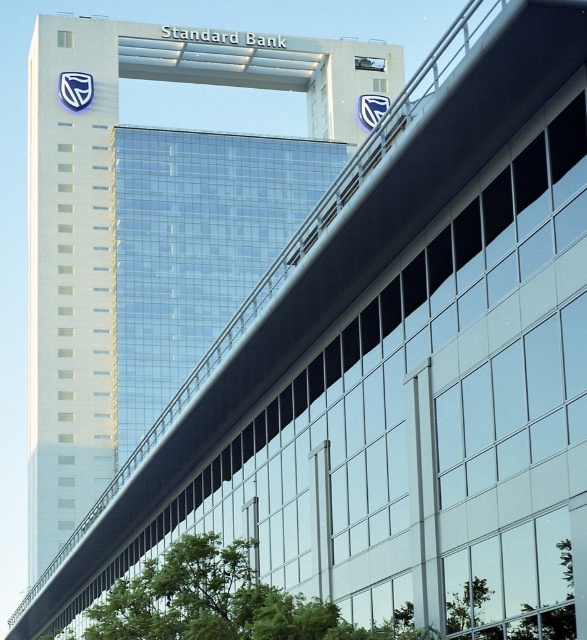
You are standing at the point labeled point (119, 237) in the image. Which building are you facing? Please answer with the exact object label from the scene description.

The point (119, 237) corresponds to the glassy blue skyscraper at upper center, so you are facing the glassy blue skyscraper at upper center.

You are a drone operator who needs to fly a drone from the glassy blue skyscraper at upper center to the transparent glass building at center. Considering their heights, which building should you start your flight from to ensure the drone descends smoothly?

The glassy blue skyscraper at upper center is much taller than the transparent glass building at center, so you should start the flight from the glassy blue skyscraper at upper center to allow the drone to descend smoothly towards the lower transparent glass building at center.